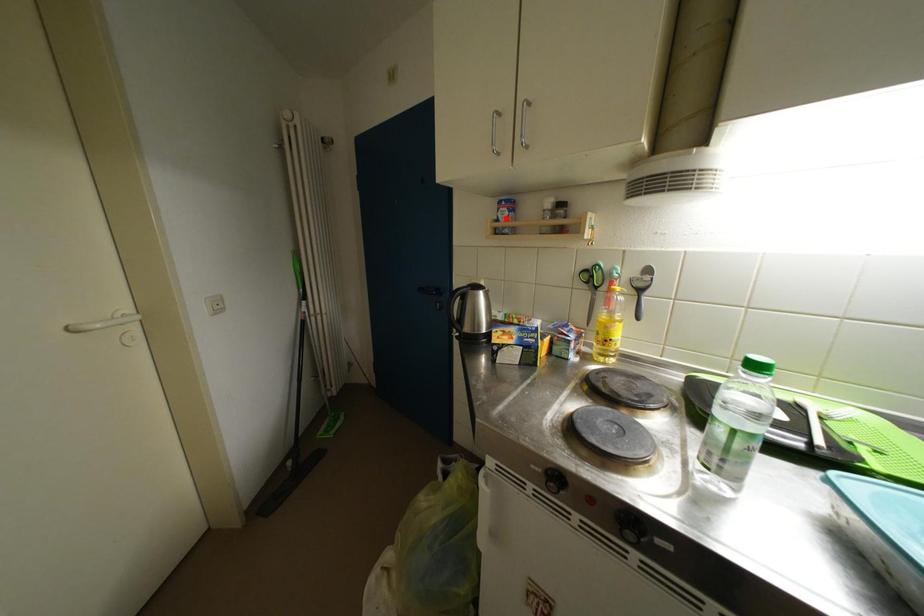
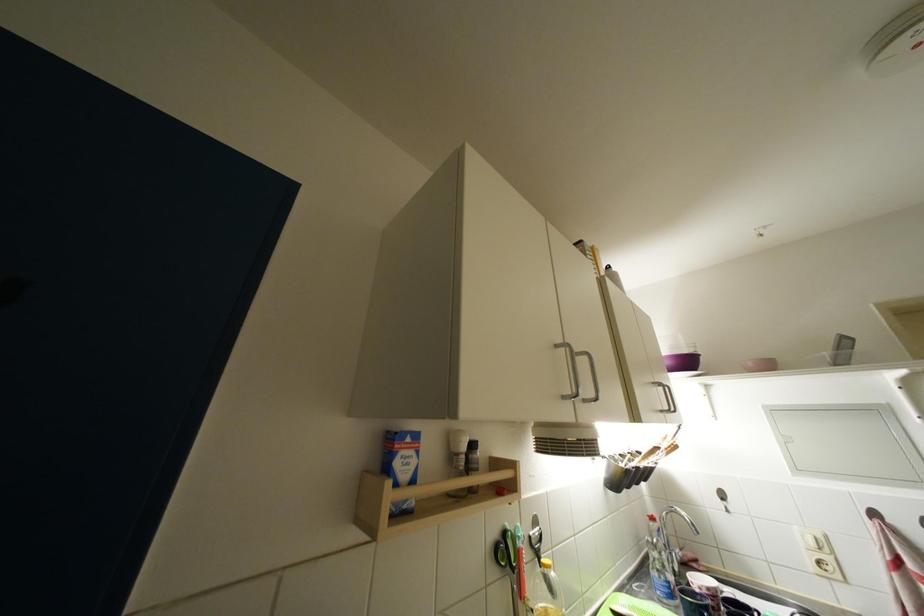
In the second image, find the point that corresponds to the highlighted location in the first image.

(404, 467)